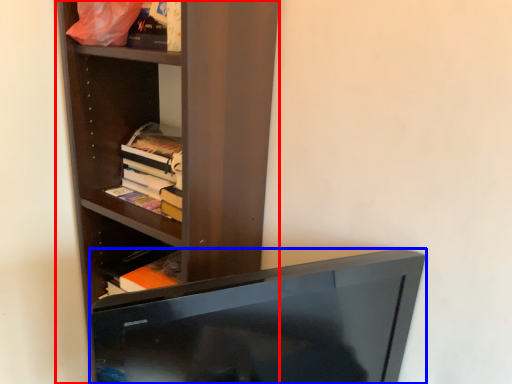
Question: Among these objects, which one is nearest to the camera, shelf (highlighted by a red box) or television (highlighted by a blue box)?

Choices:
 (A) shelf
 (B) television

Answer: (B)